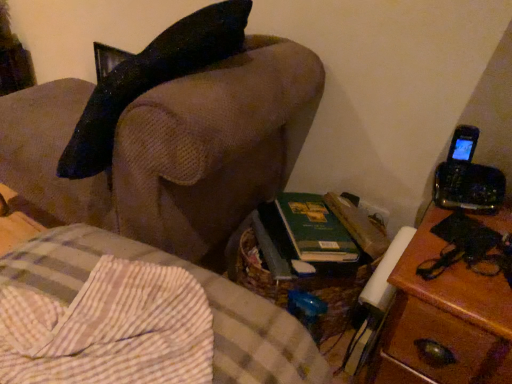
Locate an element on the screen. The width and height of the screenshot is (512, 384). free space above wooden nightstand at right (from a real-world perspective) is located at coordinates tap(475, 251).